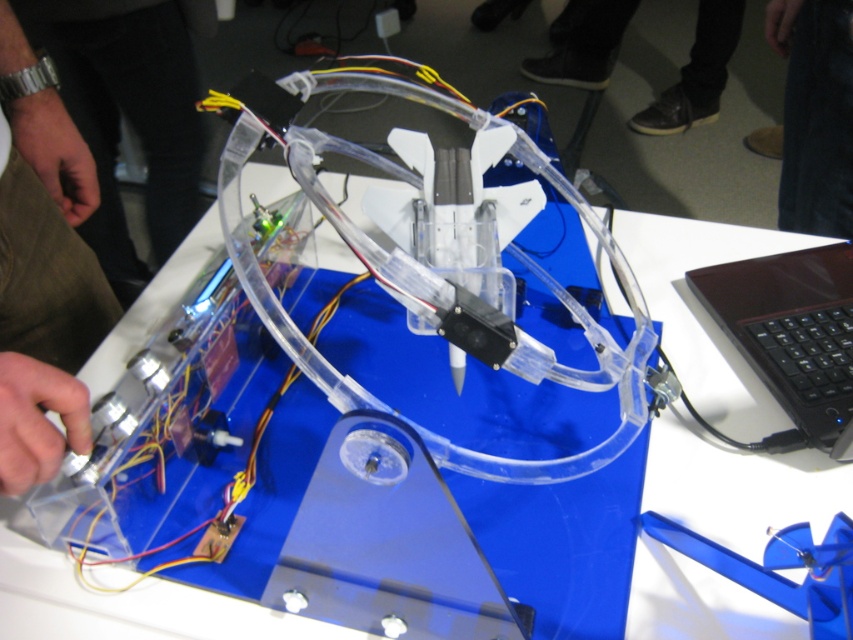
You are an engineer inspecting a wristwatch. You notice a point at coordinates (129, 113). Based on the scene description, can you determine what component this point corresponds to?

The point at coordinates (129, 113) corresponds to the metallic wristwatch at left as described in the scene.

You are an engineer inspecting a robotic arm. You notice two points labeled as point (10, 45) and another point. The robotic arm has a reach of 32 inches. Can the robotic arm reach from one point to the other without moving its base?

The two points are 33.22 inches apart, which exceeds the robotic arm reach of 32 inches. Therefore, the robotic arm cannot reach from one point to the other without moving its base.